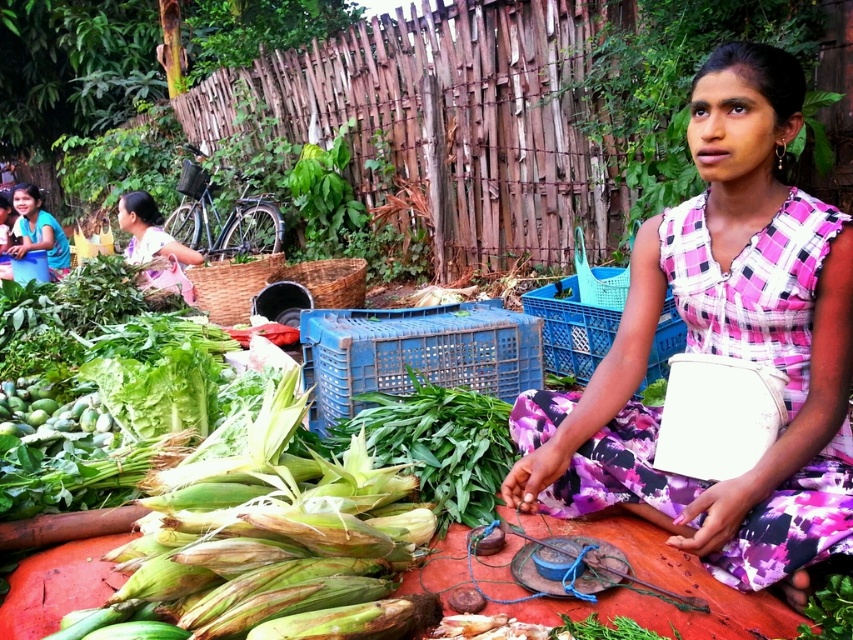
You are standing at the market and want to know which of the two points, point [759,312] or point [229,458], is closer to you. Can you determine this based on their positions?

Point [759,312] is closer to the viewer than point [229,458].

You are a customer at the market and want to pick up the green leafy vegetable at center. Is the pink plaid dress at center in your way?

The pink plaid dress at center is above the green leafy vegetable at center, so it is blocking the way to the vegetable.